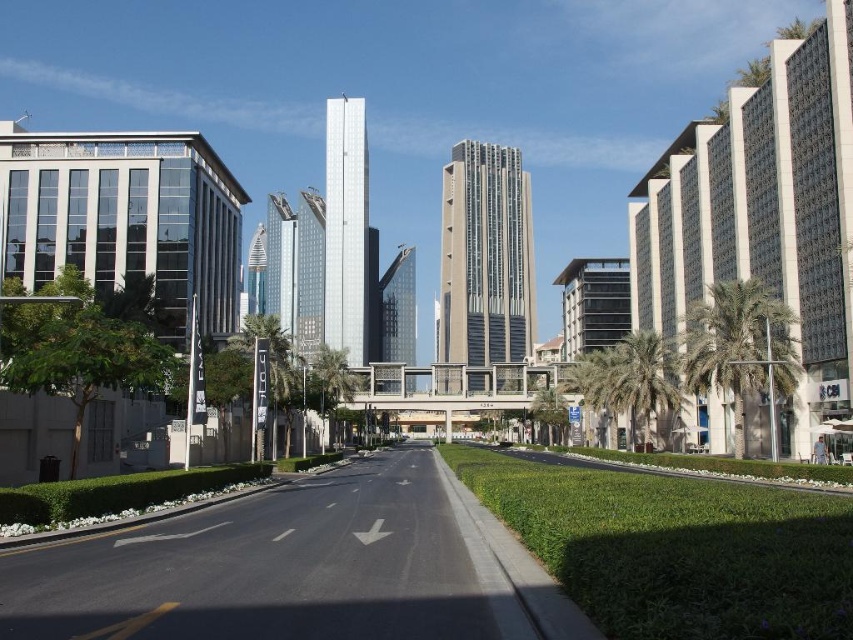
Is green leafy palm tree at right below green leafy palm tree at left?

Incorrect, green leafy palm tree at right is not positioned below green leafy palm tree at left.

What do you see at coordinates (740, 348) in the screenshot?
I see `green leafy palm tree at right` at bounding box center [740, 348].

Locate an element on the screen. green leafy palm tree at right is located at coordinates (740, 348).

Can you confirm if green leafy palm tree at right is taller than green leafy palm tree at center-right?

Indeed, green leafy palm tree at right has a greater height compared to green leafy palm tree at center-right.

Who is more distant from viewer, [705,353] or [671,368]?

Point [671,368]

At what (x,y) coordinates should I click in order to perform the action: click on green leafy palm tree at right. Please return your answer as a coordinate pair (x, y). The image size is (853, 640). Looking at the image, I should click on (740, 348).

Describe the element at coordinates (265, 371) in the screenshot. The height and width of the screenshot is (640, 853). I see `green leafy palm tree at left` at that location.

Which of these two, green leafy palm tree at left or green leafy palm tree at center, stands shorter?

green leafy palm tree at left is shorter.

Is point (270, 340) farther from viewer compared to point (335, 387)?

No, it is not.

The height and width of the screenshot is (640, 853). Identify the location of green leafy palm tree at left. (265, 371).